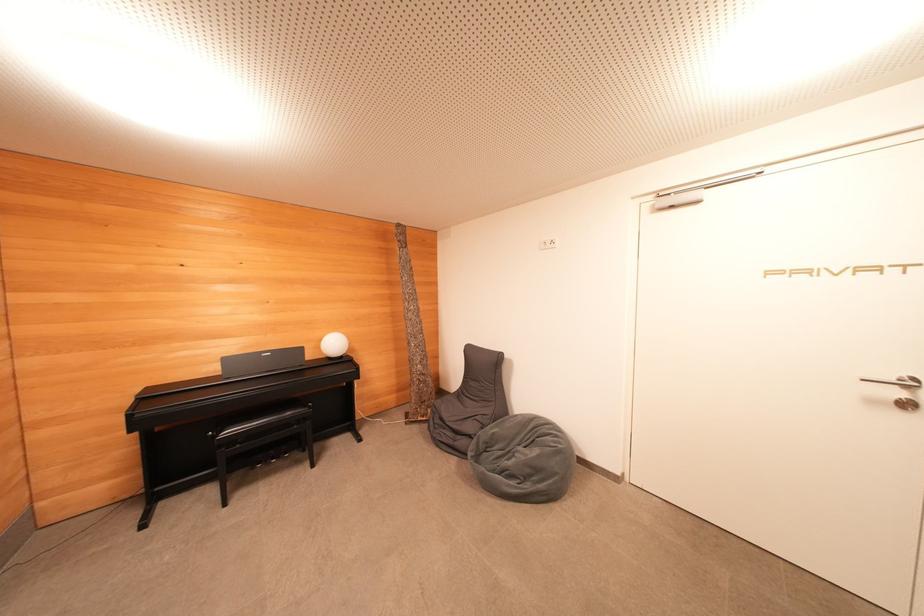
This screenshot has width=924, height=616. Describe the element at coordinates (895, 382) in the screenshot. I see `a metal door handle` at that location.